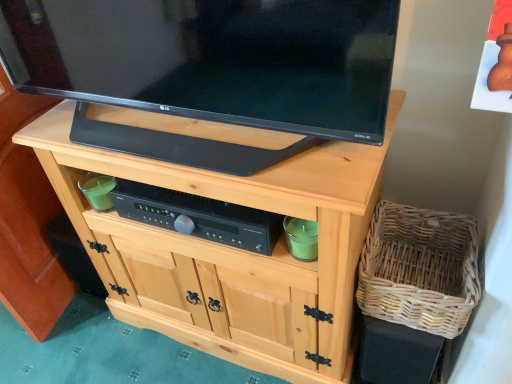
At what (x,y) coordinates should I click in order to perform the action: click on free space below black glossy tv at upper center (from a real-world perspective). Please return your answer as a coordinate pair (x, y). This screenshot has height=384, width=512. Looking at the image, I should click on (205, 125).